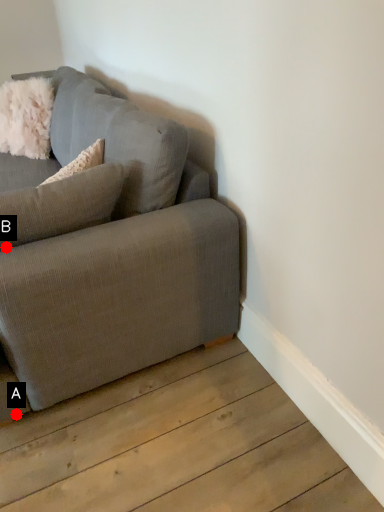
Question: Two points are circled on the image, labeled by A and B beside each circle. Which point appears farthest from the camera in this image?

Choices:
 (A) A is further
 (B) B is further

Answer: (A)